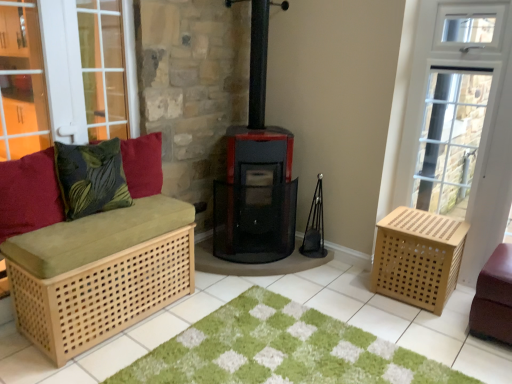
Question: Does green shaggy rug at center have a larger size compared to velvety green pillow at left, marked as the 1th pillow in a right-to-left arrangement?

Choices:
 (A) yes
 (B) no

Answer: (A)

Question: Could you tell me if green shaggy rug at center is turned towards velvety green pillow at left, marked as the 1th pillow in a right-to-left arrangement?

Choices:
 (A) no
 (B) yes

Answer: (A)

Question: Is green shaggy rug at center placed right next to velvety green pillow at left, the third pillow from the left?

Choices:
 (A) no
 (B) yes

Answer: (A)

Question: Does green shaggy rug at center come in front of velvety green pillow at left, marked as the 1th pillow in a right-to-left arrangement?

Choices:
 (A) yes
 (B) no

Answer: (A)

Question: Is green shaggy rug at center not within velvety green pillow at left, the third pillow from the left?

Choices:
 (A) no
 (B) yes

Answer: (B)

Question: Considering the positions of green leafy fabric pillow at left, which is the 2th pillow from left to right, and leather ottoman at lower right, marked as the second furniture in a left-to-right arrangement, in the image, is green leafy fabric pillow at left, which is the 2th pillow from left to right, wider or thinner than leather ottoman at lower right, marked as the second furniture in a left-to-right arrangement,?

Choices:
 (A) thin
 (B) wide

Answer: (A)

Question: Is point (78, 177) positioned closer to the camera than point (482, 332)?

Choices:
 (A) farther
 (B) closer

Answer: (B)

Question: Considering their positions, is green leafy fabric pillow at left, which is the 2th pillow from left to right, located in front of or behind leather ottoman at lower right, the 1th furniture when ordered from right to left?

Choices:
 (A) front
 (B) behind

Answer: (A)

Question: Is green leafy fabric pillow at left, placed as the 2th pillow when sorted from right to left, inside the boundaries of leather ottoman at lower right, marked as the second furniture in a left-to-right arrangement, or outside?

Choices:
 (A) outside
 (B) inside

Answer: (A)

Question: Relative to green shaggy rug at center, is leather ottoman at lower right, marked as the second furniture in a left-to-right arrangement, in front or behind?

Choices:
 (A) behind
 (B) front

Answer: (A)

Question: Does point (495, 306) appear closer or farther from the camera than point (331, 365)?

Choices:
 (A) farther
 (B) closer

Answer: (A)

Question: Considering the positions of leather ottoman at lower right, marked as the second furniture in a left-to-right arrangement, and green shaggy rug at center in the image, is leather ottoman at lower right, marked as the second furniture in a left-to-right arrangement, wider or thinner than green shaggy rug at center?

Choices:
 (A) wide
 (B) thin

Answer: (B)

Question: Looking at the image, does leather ottoman at lower right, the 1th furniture when ordered from right to left, seem bigger or smaller compared to green shaggy rug at center?

Choices:
 (A) big
 (B) small

Answer: (B)

Question: From the image's perspective, relative to natural wood crate at right, is natural wood bench at left, the 2th furniture when ordered from right to left, above or below?

Choices:
 (A) below
 (B) above

Answer: (B)

Question: Is natural wood bench at left, the 2th furniture when ordered from right to left, to the left or to the right of natural wood crate at right in the image?

Choices:
 (A) right
 (B) left

Answer: (B)